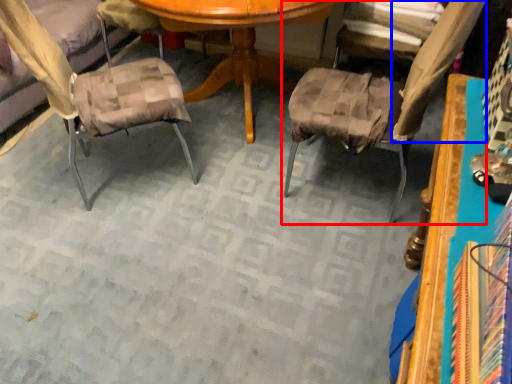
Question: Which object is closer to the camera taking this photo, chair (highlighted by a red box) or fabric (highlighted by a blue box)?

Choices:
 (A) chair
 (B) fabric

Answer: (A)